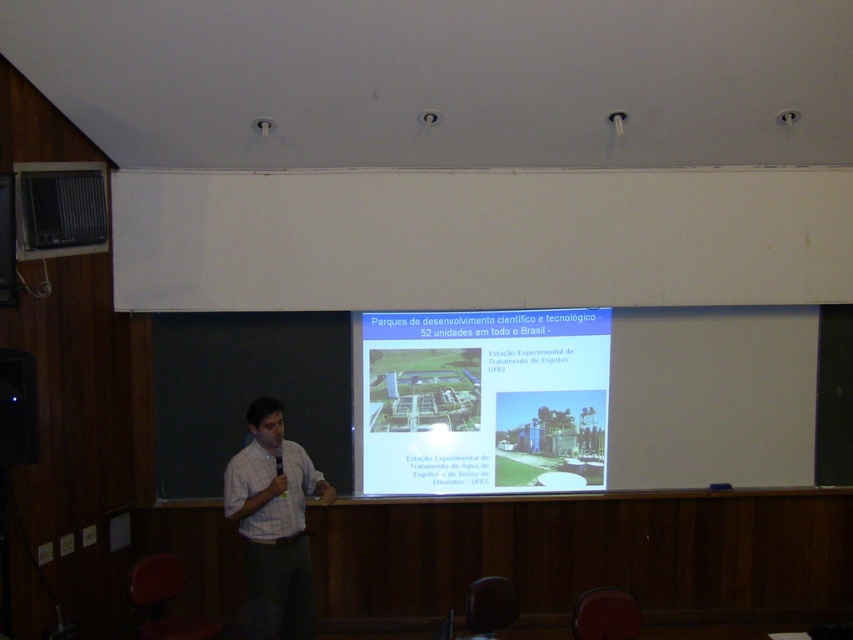
Question: Is white checkered shirt at center positioned before metallic projector at upper left?

Choices:
 (A) no
 (B) yes

Answer: (B)

Question: Among these points, which one is nearest to the camera?

Choices:
 (A) (1, 440)
 (B) (0, 211)
 (C) (305, 596)

Answer: (B)

Question: Is white matte projection screen at center above metallic projector at upper left?

Choices:
 (A) no
 (B) yes

Answer: (A)

Question: Which object is positioned farthest from the metallic projector at upper left?

Choices:
 (A) white matte projection screen at center
 (B) white checkered shirt at center
 (C) matte black shirt at left
 (D) white shirt at center

Answer: (A)

Question: From the image, what is the correct spatial relationship of metallic projector at upper left in relation to white shirt at center?

Choices:
 (A) above
 (B) below

Answer: (A)

Question: Which point is farther to the camera?

Choices:
 (A) matte black shirt at left
 (B) white shirt at center
 (C) metallic projector at upper left

Answer: (C)